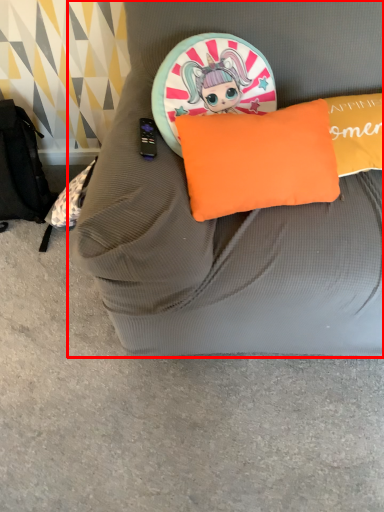
Question: From the image's perspective, where is furniture (annotated by the red box) located relative to pillow?

Choices:
 (A) above
 (B) below

Answer: (A)